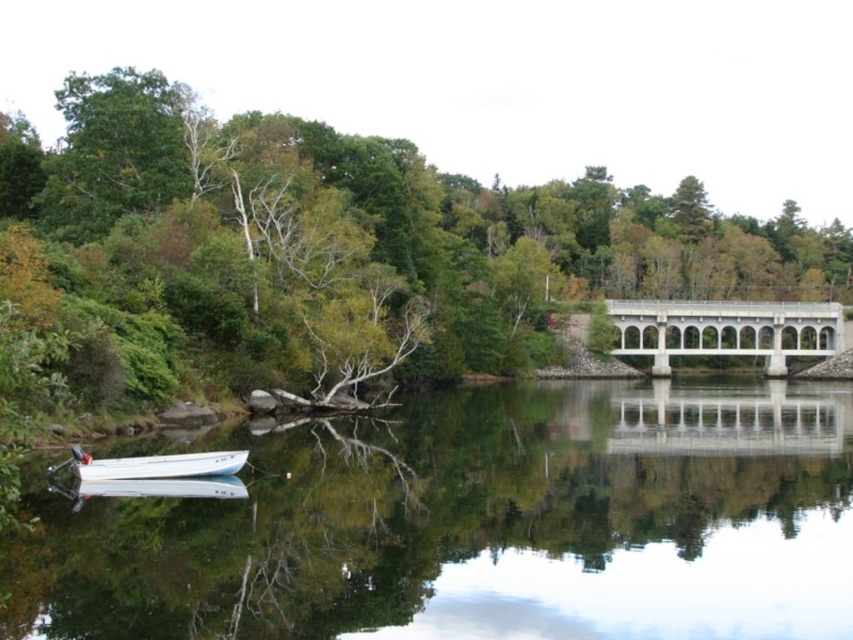
You are planning to take a photo of the white concrete bridge at center and the green leafy tree at center from the lakeside. Which object will appear wider in the photo?

The green leafy tree at center will appear wider in the photo because its width surpasses that of the white concrete bridge at center.

Looking at this image, you are standing on the lakeside and want to take a photo of the clear glass water at center and the green leafy tree at center. Which object should you frame first in your camera viewfinder to ensure both are captured in the same shot?

You should frame the clear glass water at center first because it is positioned on the left side of the green leafy tree at center, so capturing it first ensures both objects are included in the photo.